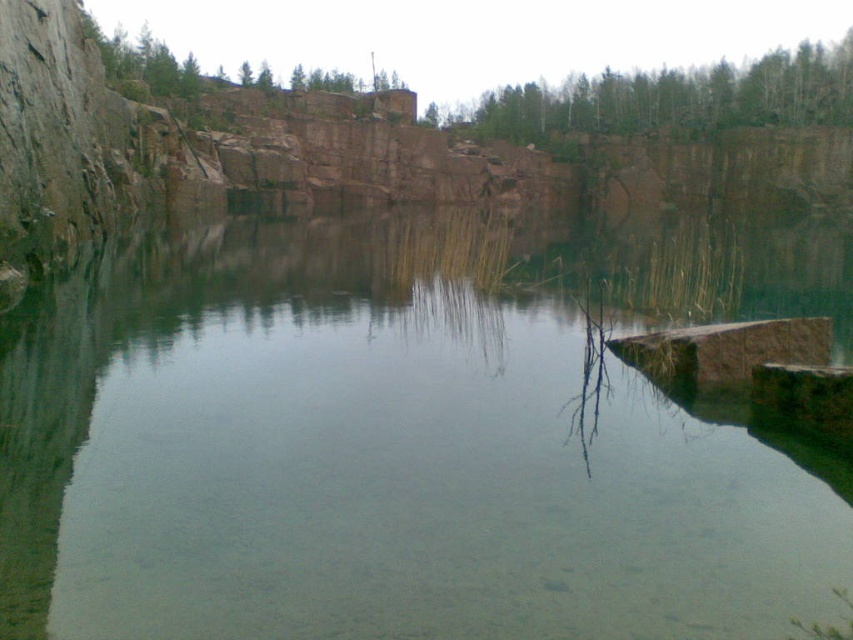
You are planning to take a photo of the quarry pond and want to ensure the clear water at center and green leafy trees at upper center are both in the frame. Given that your camera has a fixed focal length, which object should you focus on to ensure both are in focus, considering their relative sizes?

The clear water at center has a smaller width compared to the green leafy trees at upper center. To ensure both are in focus, you should focus on the green leafy trees at upper center since it is larger and closer to the camera, allowing the depth of field to cover the smaller clear water at center.

You are standing at the edge of the quarry pond and notice the clear water at center and the green leafy trees at upper center. Which object appears taller in the scene?

The green leafy trees at upper center appear taller than the clear water at center.